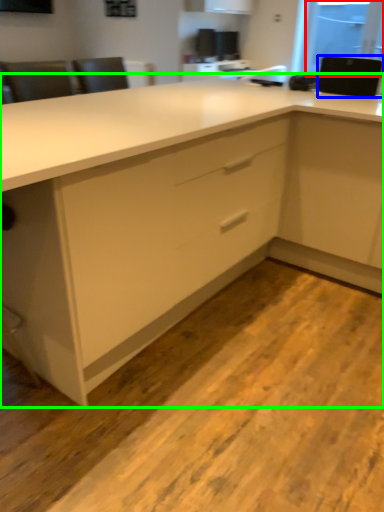
Question: Estimate the real-world distances between objects in this image. Which object is closer to window screen (highlighted by a red box), appliance (highlighted by a blue box) or cabinetry (highlighted by a green box)?

Choices:
 (A) appliance
 (B) cabinetry

Answer: (A)